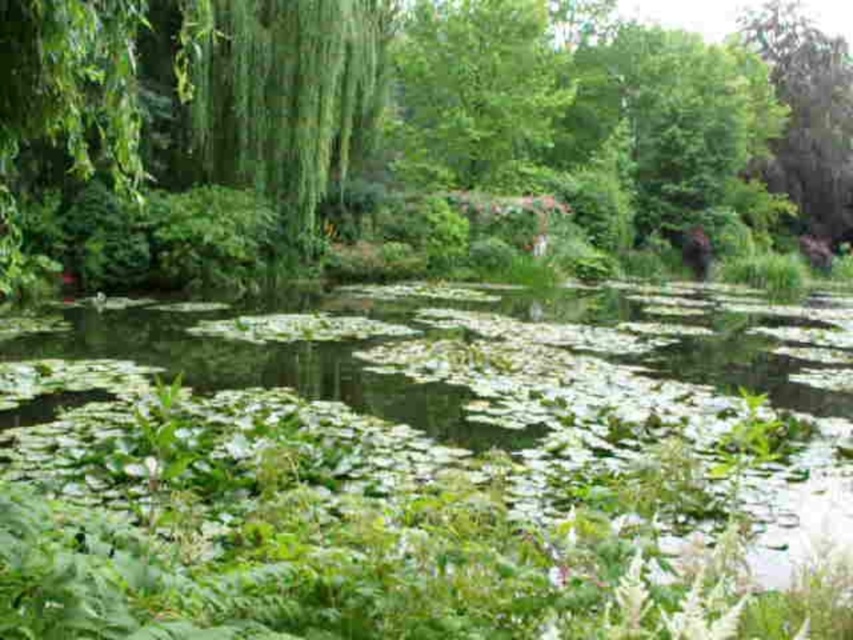
Question: Which point is farther from the camera taking this photo?

Choices:
 (A) (775, 45)
 (B) (151, 348)

Answer: (A)

Question: Is green leafy water at center below green leafy tree at upper right?

Choices:
 (A) yes
 (B) no

Answer: (A)

Question: Is green leafy water at center positioned at the back of green leafy tree at upper right?

Choices:
 (A) no
 (B) yes

Answer: (A)

Question: Which point appears closest to the camera in this image?

Choices:
 (A) (440, 342)
 (B) (787, 3)

Answer: (A)

Question: Which point is farther from the camera taking this photo?

Choices:
 (A) (792, 88)
 (B) (505, 387)

Answer: (A)

Question: Does green leafy water at center lie in front of green leafy tree at upper right?

Choices:
 (A) no
 (B) yes

Answer: (B)